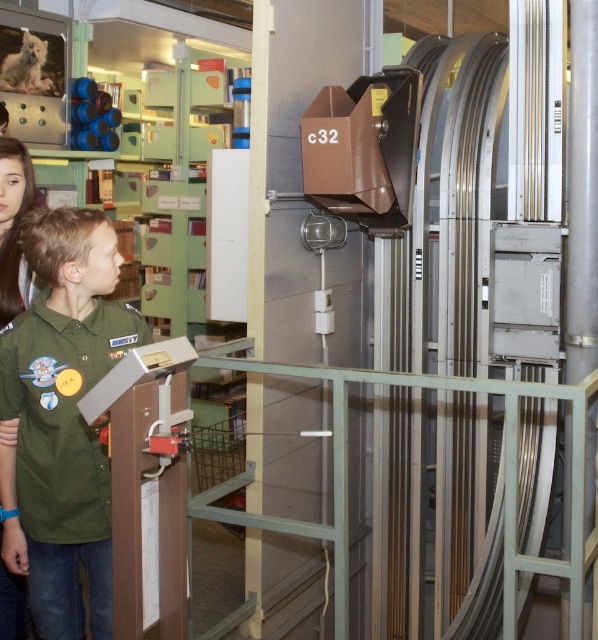
You are a security guard in the museum and need to ensure there is enough space between visitors for safety. The safety regulation requires a minimum of 60 centimeters between visitors. Are the green matte shirt at left and matte green shirt at left complying with the safety distance?

The distance between the green matte shirt at left and matte green shirt at left is 57.16 centimeters, which is less than the required 60 centimeters. Therefore, they are not complying with the safety distance.

What is the exact coordinate position of the green matte shirt at left in the image?

The green matte shirt at left is located at point (62, 420).

You are standing in the museum and want to take a photo of the industrial machinery. You notice two points marked on the floor, point 1 at coordinates point (16, 324) and point 2 at coordinates point (1, 564). Which point should you stand closer to ensure the machinery is in focus and fills the frame better?

You should stand closer to point (16, 324) because it is closer to the viewer than point (1, 564), allowing the machinery to appear larger and more centered in your photo.